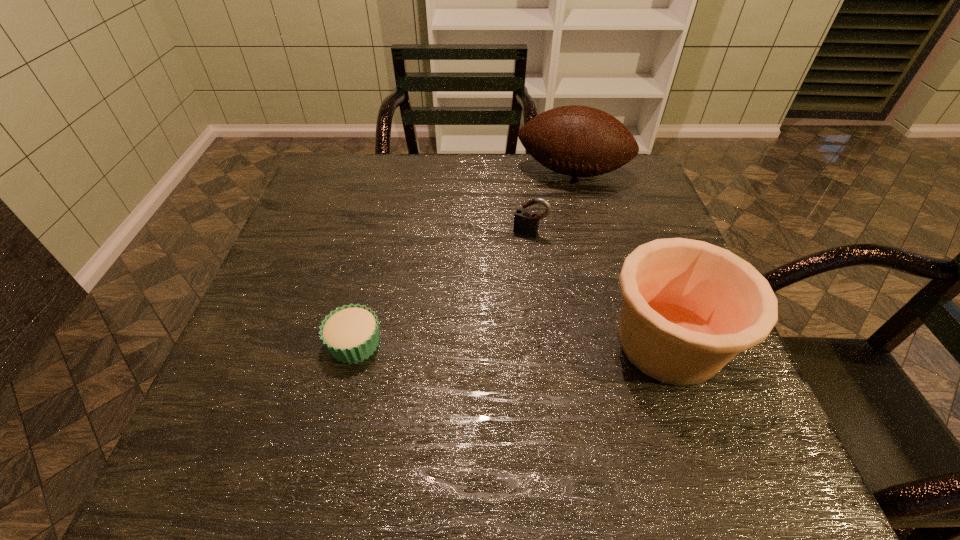
I want to click on cupcake, so click(x=351, y=333).

Find the location of a particular element. the leftmost object is located at coordinates (x=351, y=333).

This screenshot has height=540, width=960. Identify the location of pottery. tap(689, 307).

This screenshot has width=960, height=540. I want to click on padlock, so click(x=526, y=221).

At what (x,y) coordinates should I click in order to perform the action: click on the second shortest object. Please return your answer as a coordinate pair (x, y). Image resolution: width=960 pixels, height=540 pixels. Looking at the image, I should click on (526, 221).

This screenshot has width=960, height=540. Identify the location of the farthest object. (580, 141).

Find the location of a particular element. The height and width of the screenshot is (540, 960). vacant point located on the back of the cupcake is located at coordinates (384, 223).

The image size is (960, 540). In order to click on blank space located 0.240m on the back of the pottery in this screenshot , I will do `click(626, 225)`.

You are a GUI agent. You are given a task and a screenshot of the screen. Output one action in this format:
    pyautogui.click(x=<x>, y=<y>)
    Task: Click on the free region located with the keyhole on the front of the third nearest object
    
    Given the screenshot: What is the action you would take?
    pyautogui.click(x=518, y=251)

Locate an element on the screen. This screenshot has height=540, width=960. blank space located with the keyhole on the front of the third nearest object is located at coordinates (494, 301).